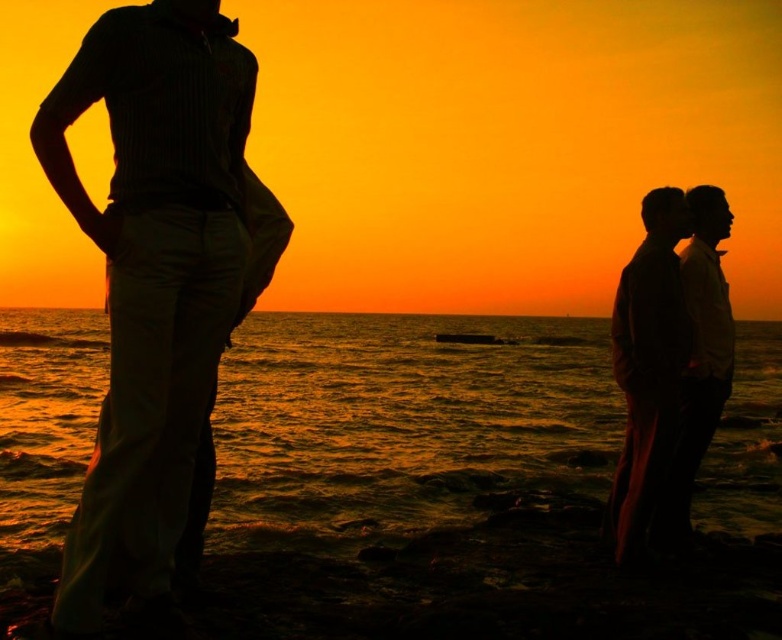
You are a photographer trying to capture the sunset scene. You want to ensure that both the silhouette couple at right and the silhouette shirt at right are in focus. Given that your camera has a depth of field that can cover 9 inches, will both subjects be in focus?

The silhouette couple at right is 8.80 inches from the silhouette shirt at right. Since the distance between them is less than the camera depth of field of 9 inches, both subjects will be in focus.

You are a photographer trying to capture the sunset scene. You notice the silhouette pants at left and the silhouette couple at right in your frame. Based on their positions, which object is wider in the image?

The silhouette pants at left might be wider than silhouette couple at right according to the description.

From the picture: You are a photographer wanting to capture the sunset scene. You notice two figures in the foreground. Which of the two, the silhouette couple at right or the silhouette shirt at right, is positioned closer to the left side of the image?

The silhouette couple at right is positioned to the left of the silhouette shirt at right, so the silhouette couple at right is closer to the left side of the image.